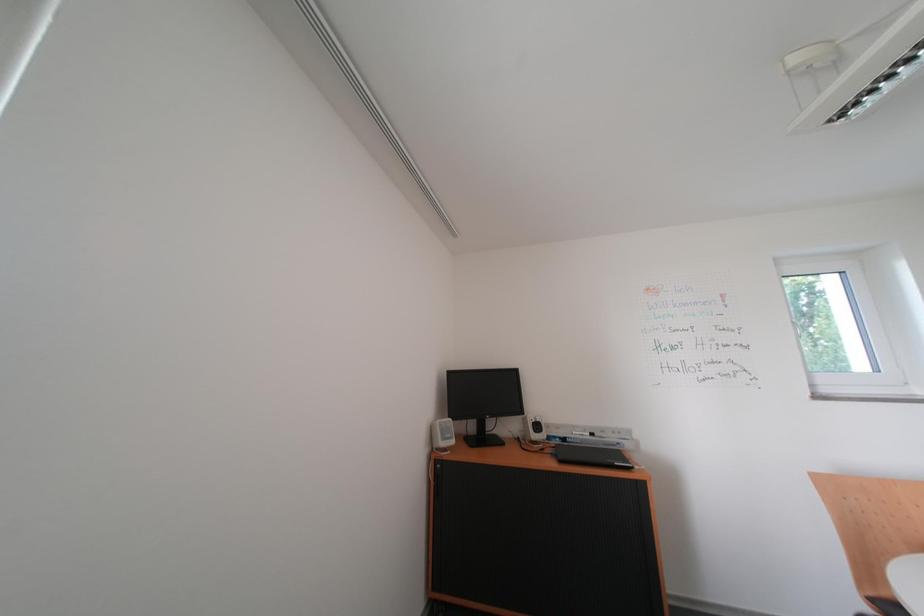
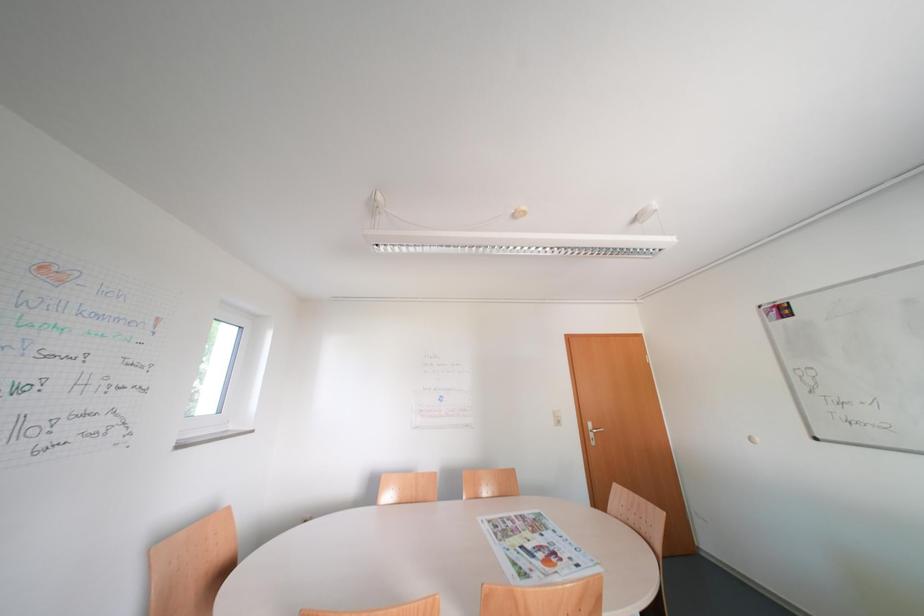
Based on the continuous images, in which direction is the camera rotating?

The rotation direction of the camera is right-up.